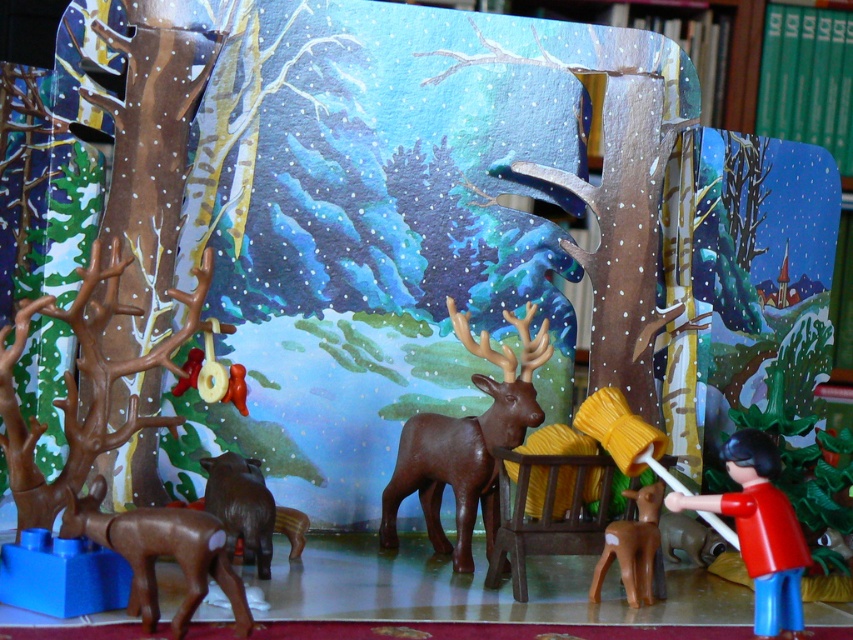
You are a child looking at the diorama and want to touch both the brown matte deer at center and the brown matte deer at lower left. Which deer should you reach for first if you want to touch the one closer to you first?

You should reach for the brown matte deer at center first because it is closer to you than the brown matte deer at lower left.

You are setting up a display and want to arrange the brown matte deer at center and the brown matte deer at lower left side by side. Which deer should you place on the left to ensure they fit within a 1.2 meter wide shelf?

The brown matte deer at lower left is narrower, so placing it on the left and the brown matte deer at center on the right would allow both to fit within the 1.2 meter wide shelf since the total width would be less than or equal to 1.2 meters.